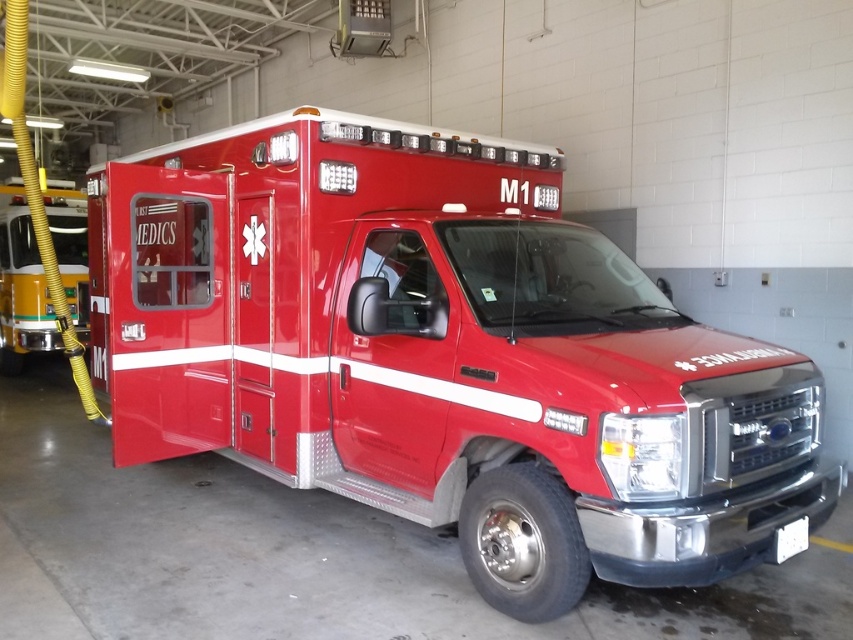
Question: Among these objects, which one is farthest from the camera?

Choices:
 (A) shiny red ambulance at center
 (B) matte yellow hose at left

Answer: (B)

Question: Can you confirm if shiny red ambulance at center is bigger than matte yellow hose at left?

Choices:
 (A) yes
 (B) no

Answer: (A)

Question: Is the position of shiny red ambulance at center less distant than that of matte yellow hose at left?

Choices:
 (A) no
 (B) yes

Answer: (B)

Question: Is shiny red ambulance at center to the left of matte yellow hose at left from the viewer's perspective?

Choices:
 (A) no
 (B) yes

Answer: (A)

Question: Which point is closer to the camera taking this photo?

Choices:
 (A) (689, 444)
 (B) (55, 227)

Answer: (A)